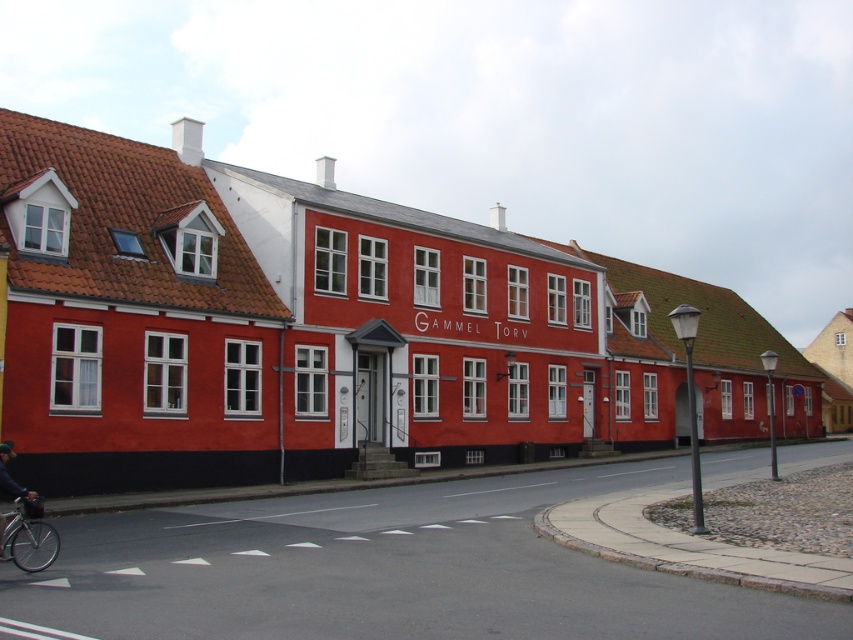
You are a delivery person standing at the pedestrian crossing in front of Gammel Torv. You need to place a package on the silver metallic bicycle at lower left but there is a dark blue fabric jacket at lower left in the way. Can you estimate if you can reach the bicycle without moving the jacket?

The distance between the silver metallic bicycle at lower left and dark blue fabric jacket at lower left is 37.98 inches, so yes, you can reach the bicycle without moving the jacket since the jacket is not blocking the path between them.

You are a delivery person with a package that is 1.2 meters wide. You need to pass through the space between the silver metallic bicycle at lower left and the dark blue fabric jacket at lower left. Can your package fit through that space?

The silver metallic bicycle at lower left has a lesser width compared to dark blue fabric jacket at lower left. Since the bicycle is narrower than the jacket, the space between them may be sufficient for the package. However, without knowing the exact distance between the two objects, it is uncertain if the 1.2 meters wide package can fit through the space.

Consider the image. You are standing on the street in front of the Gammel Torv building and want to take a photo. There are two points marked on the ground where you can stand to frame your shot. The first point is at coordinate point (4, 520) and the second is at point (0, 554). Which point should you choose if you want to be closer to the building?

You should choose point (4, 520) because it is further to the camera than point (0, 554), meaning it is closer to the building.